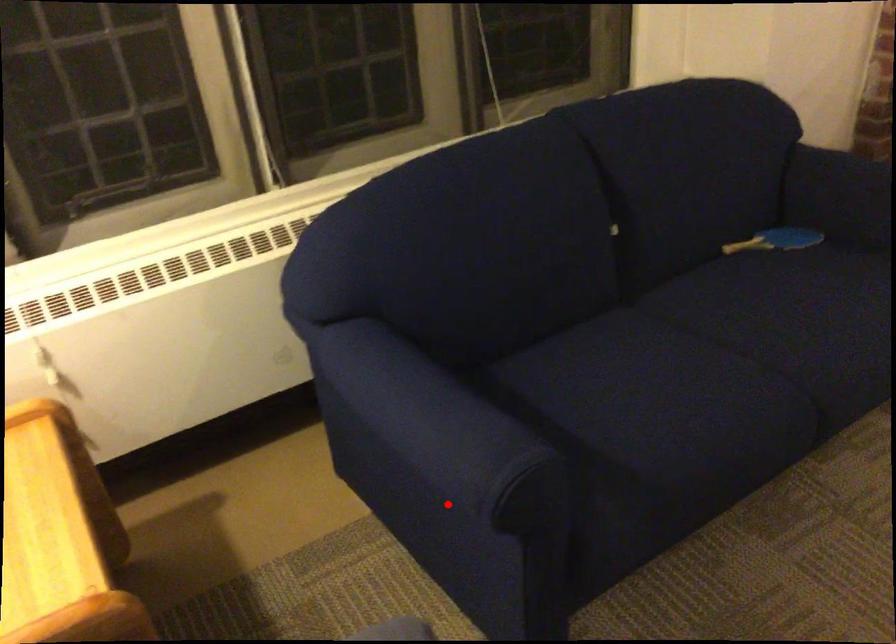
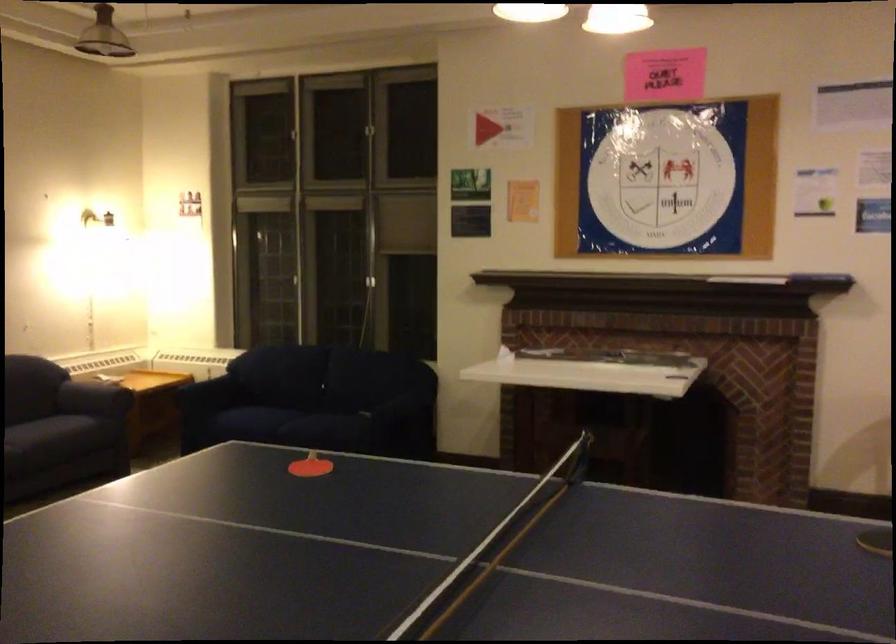
Question: I am providing you with two images of the same scene from different viewpoints. In image1, a red point is highlighted. Considering the same 3D point in image2, which of the following is correct?

Choices:
 (A) It is closer
 (B) It is farther

Answer: (B)